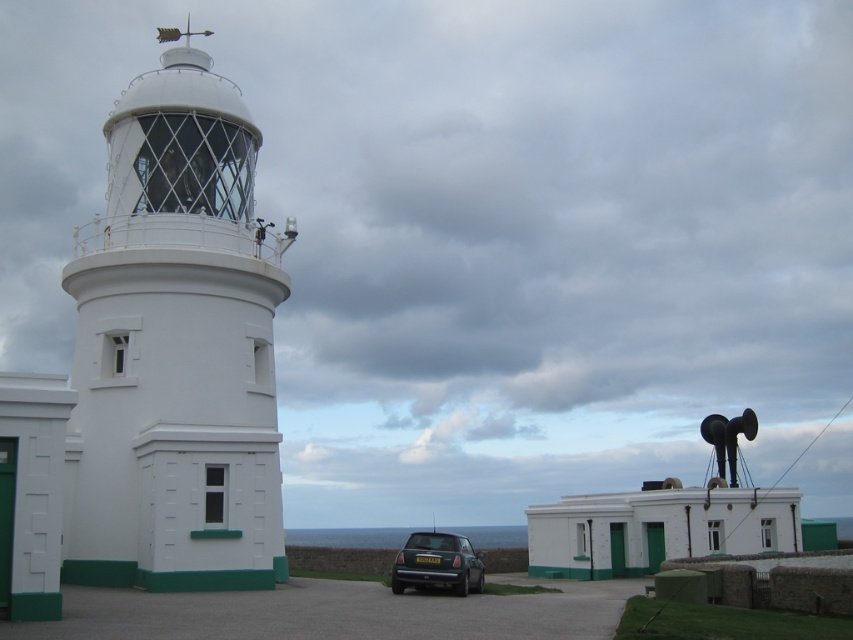
Is white glass lighthouse at left bigger than metallic gray hatchback at lower center?

Correct, white glass lighthouse at left is larger in size than metallic gray hatchback at lower center.

Measure the distance from white glass lighthouse at left to metallic gray hatchback at lower center.

white glass lighthouse at left is 15.50 meters from metallic gray hatchback at lower center.

Does point (170, 189) lie in front of point (399, 593)?

No.

This screenshot has width=853, height=640. What are the coordinates of `white glass lighthouse at left` in the screenshot? It's located at (175, 348).